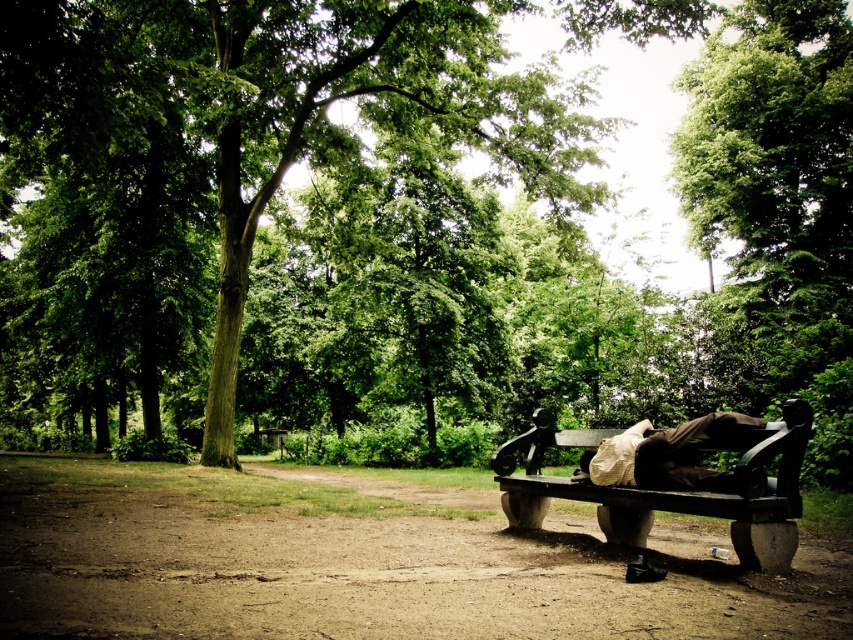
Question: Which of these objects is positioned farthest from the brown fabric bag at lower right?

Choices:
 (A) wooden bench at lower right
 (B) green leafy tree at center

Answer: (B)

Question: Is wooden bench at lower right positioned before brown fabric bag at lower right?

Choices:
 (A) no
 (B) yes

Answer: (B)

Question: Among these objects, which one is farthest from the camera?

Choices:
 (A) wooden bench at lower right
 (B) brown fabric bag at lower right
 (C) green leafy tree at center

Answer: (C)

Question: Is wooden bench at lower right to the right of brown fabric bag at lower right from the viewer's perspective?

Choices:
 (A) no
 (B) yes

Answer: (A)

Question: Can you confirm if green leafy tree at center is positioned to the left of wooden bench at lower right?

Choices:
 (A) no
 (B) yes

Answer: (B)

Question: Which is farther from the wooden bench at lower right?

Choices:
 (A) brown fabric bag at lower right
 (B) green leafy tree at center

Answer: (B)